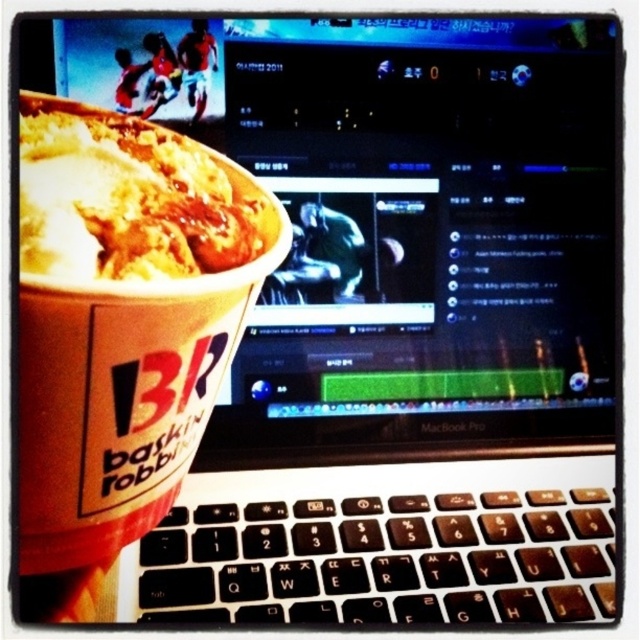
Between black plastic keyboard at center and white creamy ice cream at left, which one has more height?

With more height is white creamy ice cream at left.

Between black plastic keyboard at center and white creamy ice cream at left, which one has less height?

With less height is black plastic keyboard at center.

The width and height of the screenshot is (640, 640). Identify the location of black plastic keyboard at center. (381, 552).